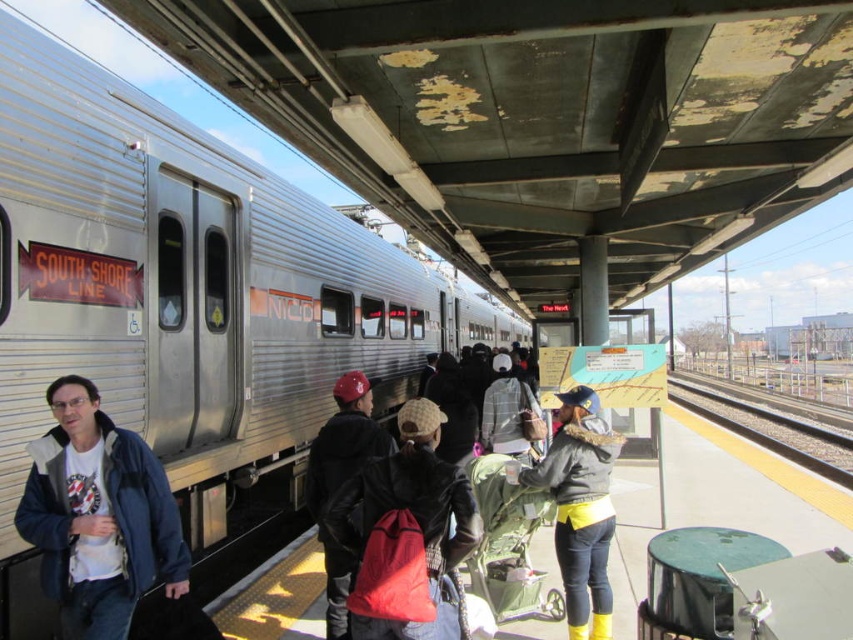
Question: Can you confirm if matte black jacket at center is thinner than yellow gravel train track at lower right?

Choices:
 (A) yes
 (B) no

Answer: (A)

Question: Among these objects, which one is farthest from the camera?

Choices:
 (A) matte blue jacket at center
 (B) yellow gravel train track at lower right
 (C) matte black jacket at center
 (D) black leather jacket at center

Answer: (B)

Question: Is black leather jacket at center to the right of yellow gravel train track at lower right from the viewer's perspective?

Choices:
 (A) no
 (B) yes

Answer: (A)

Question: Which of the following is the closest to the observer?

Choices:
 (A) matte black jacket at center
 (B) black leather jacket at center
 (C) yellow gravel train track at lower right
 (D) matte blue jacket at center

Answer: (D)

Question: Is matte blue jacket at center smaller than matte black jacket at center?

Choices:
 (A) yes
 (B) no

Answer: (A)

Question: Which object appears farthest from the camera in this image?

Choices:
 (A) matte black jacket at center
 (B) black leather jacket at center

Answer: (A)